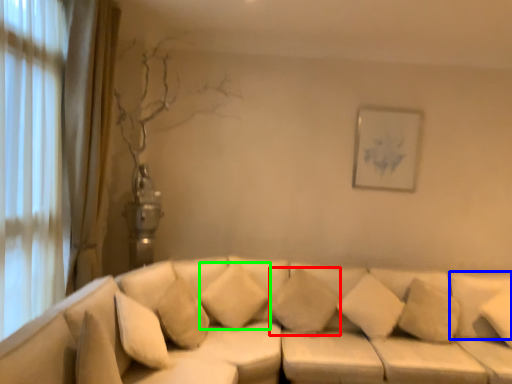
Question: Estimate the real-world distances between objects in this image. Which object is farther from pillow (highlighted by a red box), pillow (highlighted by a blue box) or pillow (highlighted by a green box)?

Choices:
 (A) pillow
 (B) pillow

Answer: (A)